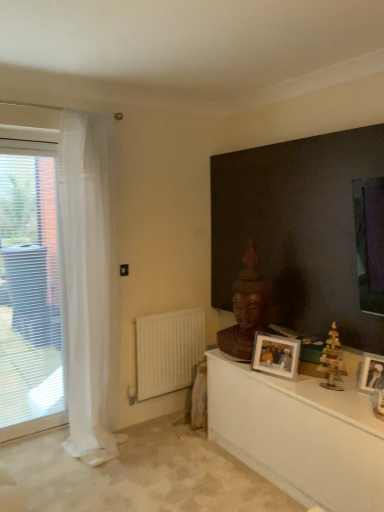
Question: Is white matte radiator at lower left completely or partially outside of metallic silver photo frame at right, arranged as the 1th picture frame when viewed from the front?

Choices:
 (A) no
 (B) yes

Answer: (B)

Question: From the image's perspective, is white matte radiator at lower left over metallic silver photo frame at right, arranged as the 1th picture frame when viewed from the front?

Choices:
 (A) no
 (B) yes

Answer: (A)

Question: Could you tell me if white matte radiator at lower left is turned towards metallic silver photo frame at right, positioned as the 2th picture frame in left-to-right order?

Choices:
 (A) yes
 (B) no

Answer: (A)

Question: From the image's perspective, is white matte radiator at lower left under metallic silver photo frame at right, arranged as the 1th picture frame when viewed from the front?

Choices:
 (A) no
 (B) yes

Answer: (B)

Question: Can you confirm if white matte radiator at lower left is thinner than metallic silver photo frame at right, placed as the first picture frame when sorted from right to left?

Choices:
 (A) no
 (B) yes

Answer: (A)

Question: Considering the positions of transparent glass window at left and wooden toy at right in the image, is transparent glass window at left wider or thinner than wooden toy at right?

Choices:
 (A) wide
 (B) thin

Answer: (A)

Question: Considering the positions of transparent glass window at left and wooden toy at right in the image, is transparent glass window at left taller or shorter than wooden toy at right?

Choices:
 (A) tall
 (B) short

Answer: (A)

Question: Is transparent glass window at left in front of or behind wooden toy at right in the image?

Choices:
 (A) front
 (B) behind

Answer: (B)

Question: Is transparent glass window at left inside or outside of wooden toy at right?

Choices:
 (A) outside
 (B) inside

Answer: (A)

Question: Does point (157, 389) appear closer or farther from the camera than point (344, 371)?

Choices:
 (A) closer
 (B) farther

Answer: (B)

Question: In terms of width, does white matte radiator at lower left look wider or thinner when compared to wooden toy at right?

Choices:
 (A) wide
 (B) thin

Answer: (A)

Question: Which is correct: white matte radiator at lower left is inside wooden toy at right, or outside of it?

Choices:
 (A) outside
 (B) inside

Answer: (A)

Question: Relative to wooden toy at right, is white matte radiator at lower left in front or behind?

Choices:
 (A) front
 (B) behind

Answer: (B)

Question: From a real-world perspective, is wooden toy at right physically located above or below white glossy table at lower right?

Choices:
 (A) above
 (B) below

Answer: (A)

Question: Based on their sizes in the image, would you say wooden toy at right is bigger or smaller than white glossy table at lower right?

Choices:
 (A) big
 (B) small

Answer: (B)